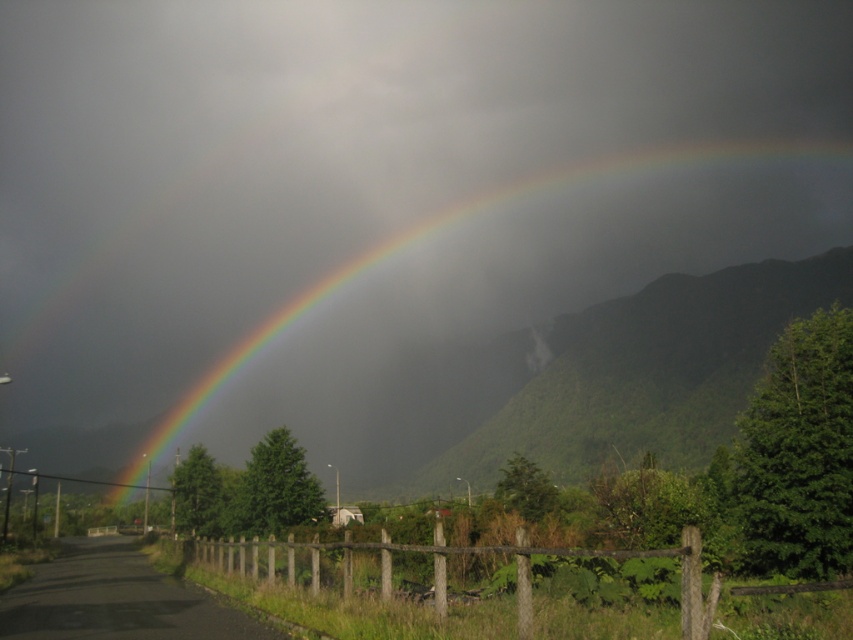
Question: Which point appears farthest from the camera in this image?

Choices:
 (A) (489, 413)
 (B) (561, 417)
 (C) (589, 557)

Answer: (A)

Question: Where is rainbow at upper center located in relation to green leafy mountain at center in the image?

Choices:
 (A) below
 (B) above

Answer: (B)

Question: Which of these objects is positioned farthest from the brown wooden fence at lower center?

Choices:
 (A) green leafy mountain at center
 (B) rainbow at upper center

Answer: (B)

Question: Which object is the farthest from the brown wooden fence at lower center?

Choices:
 (A) rainbow at upper center
 (B) green leafy mountain at center

Answer: (A)

Question: Can you confirm if green leafy mountain at center is wider than brown wooden fence at lower center?

Choices:
 (A) yes
 (B) no

Answer: (A)

Question: Is rainbow at upper center wider than green leafy mountain at center?

Choices:
 (A) yes
 (B) no

Answer: (A)